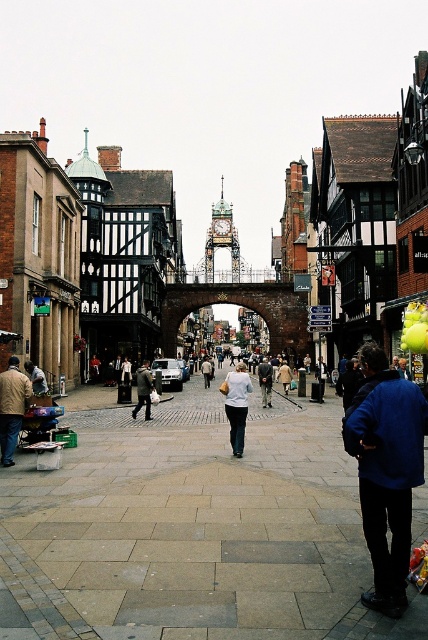
Is blue fabric jacket at lower right above white matte jacket at center?

Actually, blue fabric jacket at lower right is below white matte jacket at center.

The image size is (428, 640). What do you see at coordinates (386, 470) in the screenshot? I see `blue fabric jacket at lower right` at bounding box center [386, 470].

The width and height of the screenshot is (428, 640). I want to click on blue fabric jacket at lower right, so click(386, 470).

Can you confirm if blue fabric jacket at lower right is positioned to the left of white cotton shirt at center?

No, blue fabric jacket at lower right is not to the left of white cotton shirt at center.

Between blue fabric jacket at lower right and white cotton shirt at center, which one is positioned lower?

white cotton shirt at center is lower down.

This screenshot has height=640, width=428. I want to click on blue fabric jacket at lower right, so click(x=386, y=470).

Between white matte jacket at center and light brown leather jacket at lower left, which one is positioned lower?

white matte jacket at center is lower down.

Can you confirm if white matte jacket at center is bigger than light brown leather jacket at lower left?

Correct, white matte jacket at center is larger in size than light brown leather jacket at lower left.

The image size is (428, 640). I want to click on white matte jacket at center, so click(237, 404).

You are a GUI agent. You are given a task and a screenshot of the screen. Output one action in this format:
    pyautogui.click(x=<x>, y=<y>)
    Task: Click on the white matte jacket at center
    The height and width of the screenshot is (640, 428).
    Given the screenshot: What is the action you would take?
    pyautogui.click(x=237, y=404)